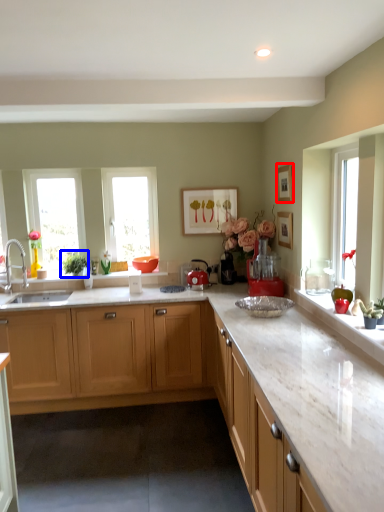
Question: Which object appears farthest to the camera in this image, picture frame (highlighted by a red box) or plant (highlighted by a blue box)?

Choices:
 (A) picture frame
 (B) plant

Answer: (B)